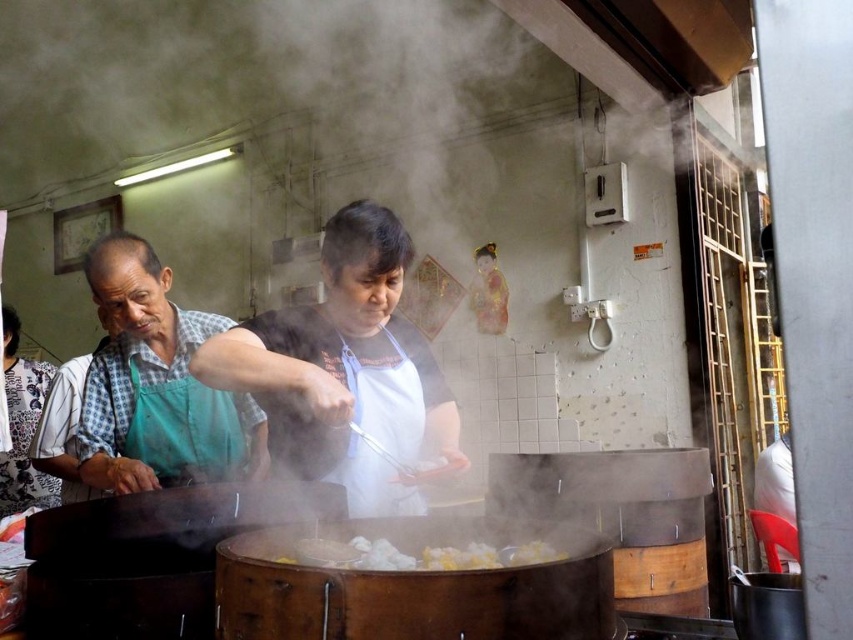
Question: Observing the image, what is the correct spatial positioning of white apron at center in reference to white fluffy dumplings at center?

Choices:
 (A) below
 (B) above

Answer: (B)

Question: Which object is positioned closest to the white apron at center?

Choices:
 (A) green apron at left
 (B) white fluffy dumplings at center

Answer: (B)

Question: Is green apron at left above white fluffy dumplings at center?

Choices:
 (A) no
 (B) yes

Answer: (B)

Question: Which is farther from the white apron at center?

Choices:
 (A) white fluffy dumplings at center
 (B) green apron at left

Answer: (B)

Question: Does white apron at center have a smaller size compared to white fluffy dumplings at center?

Choices:
 (A) no
 (B) yes

Answer: (A)

Question: Which point is farther to the camera?

Choices:
 (A) white apron at center
 (B) white fluffy dumplings at center
 (C) green apron at left

Answer: (C)